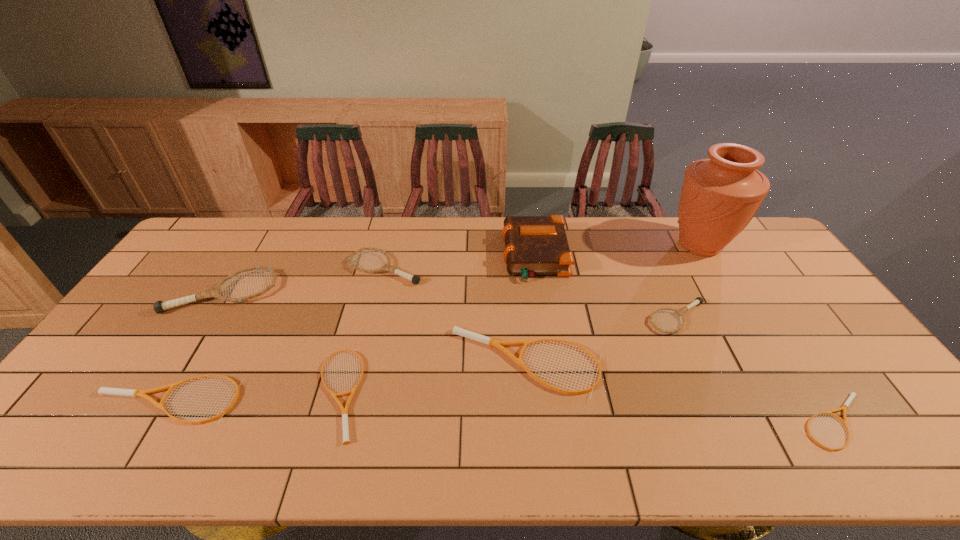
Where is `free spot that satisfies the following two spatial constraints: 1. on the back side of the fifth tennis racket from left to right; 2. on the left side of the second smallest beige tennis racket`? free spot that satisfies the following two spatial constraints: 1. on the back side of the fifth tennis racket from left to right; 2. on the left side of the second smallest beige tennis racket is located at coordinates (345, 363).